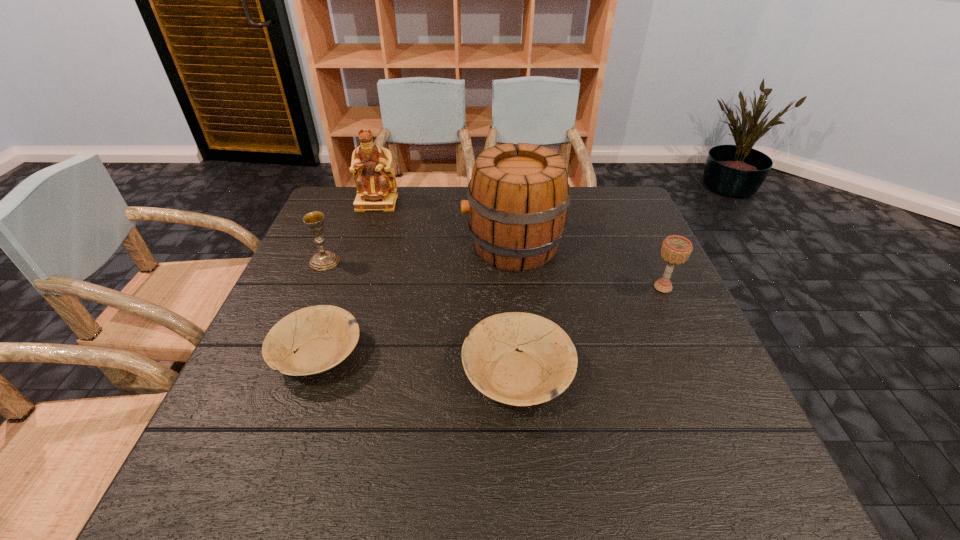
The image size is (960, 540). Identify the location of bowl located at the left edge. click(322, 336).

Where is `figurine present at the left edge`? The image size is (960, 540). figurine present at the left edge is located at coordinates (375, 181).

In order to click on chalice that is positioned at the left edge in this screenshot , I will do `click(324, 260)`.

Locate an element on the screen. This screenshot has height=540, width=960. object present at the right edge is located at coordinates (675, 250).

What are the coordinates of `object positioned at the far left corner` in the screenshot? It's located at (375, 181).

Identify the location of free space at the far edge of the desktop. (440, 199).

In the image, there is a desktop. In order to click on vacant region at the near edge in this screenshot , I will do `click(464, 408)`.

The image size is (960, 540). What are the coordinates of `free location at the left edge of the desktop` in the screenshot? It's located at (314, 245).

At what (x,y) coordinates should I click in order to perform the action: click on vacant space at the right edge of the desktop. Please return your answer as a coordinate pair (x, y). The height and width of the screenshot is (540, 960). Looking at the image, I should click on (620, 292).

Locate an element on the screen. The width and height of the screenshot is (960, 540). free region at the near right corner is located at coordinates (699, 412).